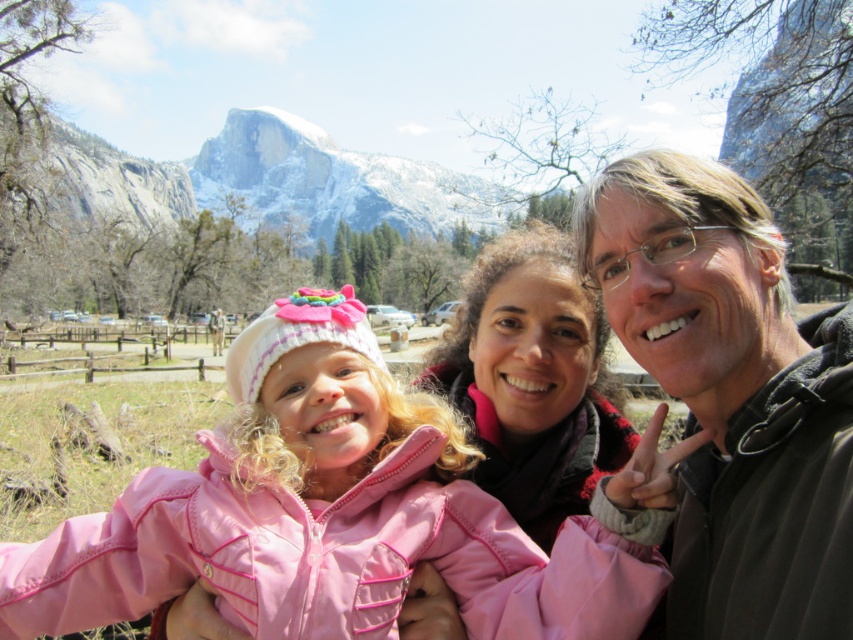
Is matte black jacket at right below matte pink jacket at center?

Incorrect, matte black jacket at right is not positioned below matte pink jacket at center.

Between matte black jacket at right and matte pink jacket at center, which one appears on the left side from the viewer's perspective?

matte pink jacket at center is more to the left.

What do you see at coordinates (732, 396) in the screenshot? I see `matte black jacket at right` at bounding box center [732, 396].

Locate an element on the screen. This screenshot has height=640, width=853. matte black jacket at right is located at coordinates (732, 396).

Which is in front, point (534, 573) or point (675, 186)?

Positioned in front is point (534, 573).

Does pink fleece jacket at center have a larger size compared to matte black jacket at right?

Yes, pink fleece jacket at center is bigger than matte black jacket at right.

Who is more distant from viewer, (619, 593) or (669, 604)?

Point (669, 604)

This screenshot has height=640, width=853. Find the location of `pink fleece jacket at center`. pink fleece jacket at center is located at coordinates (331, 515).

Is point (529, 429) farther from camera compared to point (193, 180)?

No, (529, 429) is closer to viewer.

Is point (560, 460) positioned after point (410, 227)?

No, (560, 460) is in front of (410, 227).

Find the location of a particular element. The width and height of the screenshot is (853, 640). matte pink jacket at center is located at coordinates (532, 380).